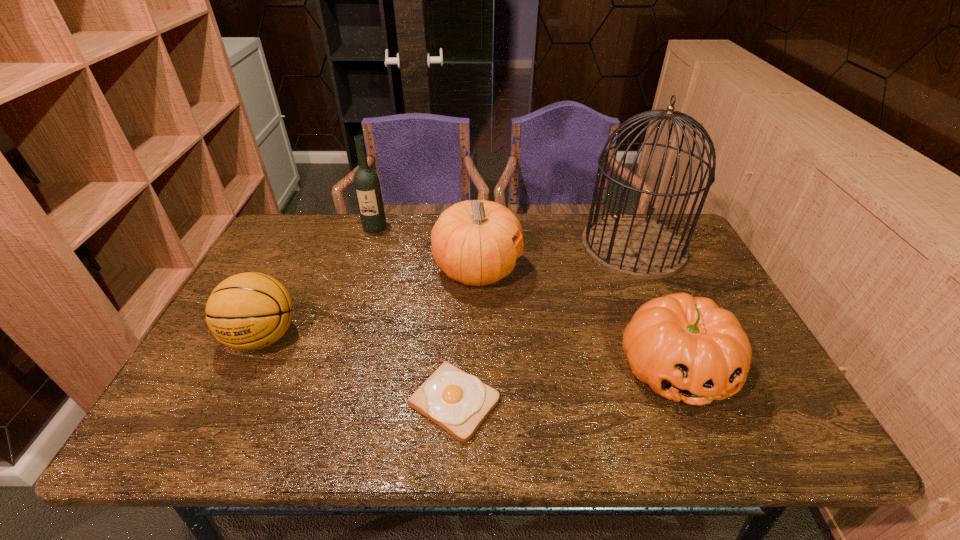
Locate an element on the screen. This screenshot has width=960, height=540. the tallest object is located at coordinates (637, 247).

This screenshot has height=540, width=960. Find the location of `the second object from left to right`. the second object from left to right is located at coordinates (367, 187).

Find the location of a particular element. Image resolution: width=960 pixels, height=540 pixels. wine bottle is located at coordinates (367, 187).

Locate an element on the screen. the taller pumpkin is located at coordinates (471, 241).

Where is `the farther pumpkin`? This screenshot has height=540, width=960. the farther pumpkin is located at coordinates (471, 241).

This screenshot has height=540, width=960. In order to click on the leftmost object in this screenshot , I will do `click(248, 311)`.

Identify the location of the shorter pumpkin. This screenshot has width=960, height=540. (686, 348).

This screenshot has height=540, width=960. What are the coordinates of `the right pumpkin` in the screenshot? It's located at (686, 348).

Locate an element on the screen. toast is located at coordinates pos(459,402).

What are the coordinates of `vacant region located at the door of the birdcage` in the screenshot? It's located at (678, 350).